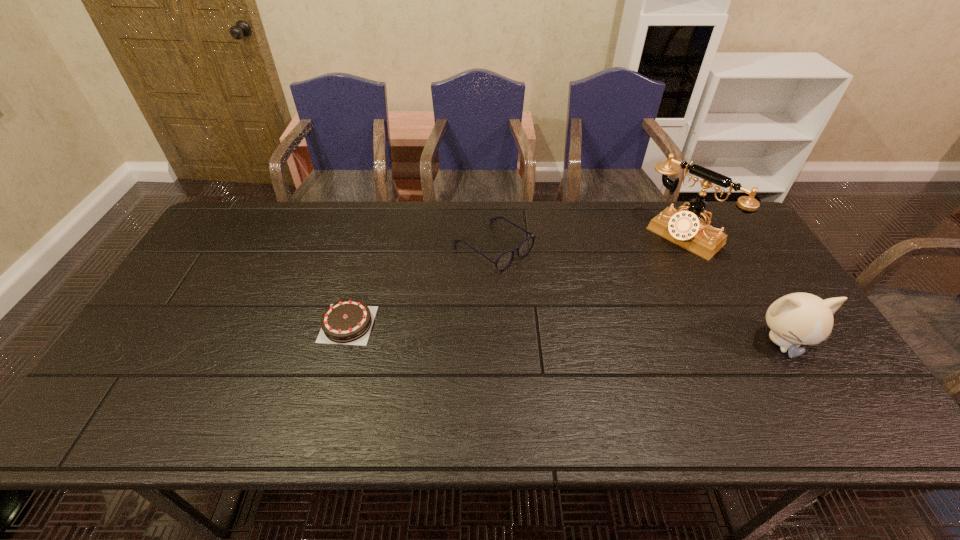
At what (x,y) coordinates should I click in order to perform the action: click on free space on the desktop that is between the shortest object and the third shortest object and is positioned on the front-facing side of the second shortest object. Please return your answer as a coordinate pair (x, y). The height and width of the screenshot is (540, 960). Looking at the image, I should click on 621,335.

Where is `vacant spot on the desktop that is between the shortest object and the kitten and is positioned on the dial of the tallest object`? vacant spot on the desktop that is between the shortest object and the kitten and is positioned on the dial of the tallest object is located at coordinates (571, 333).